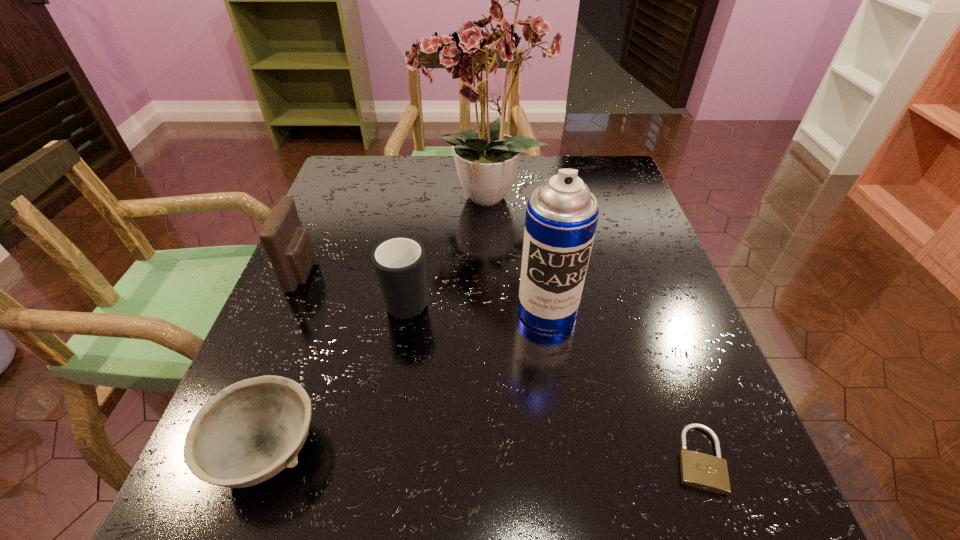
Choose which object is the nearest neighbor to the tallest object. Please provide its 2D coordinates. Your answer should be formatted as a tuple, i.e. [(x, y)], where the tuple contains the x and y coordinates of a point satisfying the conditions above.

[(399, 262)]

The width and height of the screenshot is (960, 540). What are the coordinates of `free region that satisfies the following two spatial constraints: 1. on the label side of the second tallest object; 2. on the right side of the padlock` in the screenshot? It's located at (568, 458).

Locate an element on the screen. This screenshot has width=960, height=540. free space that satisfies the following two spatial constraints: 1. with an open flap on the pouch; 2. on the left side of the bowl is located at coordinates (229, 451).

Identify the location of free location that satisfies the following two spatial constraints: 1. on the side of the mug with the handle; 2. with an open flap on the pouch. (412, 273).

Identify the location of free location that satisfies the following two spatial constraints: 1. on the label side of the aerosol can; 2. on the left side of the rightmost object. (568, 458).

The width and height of the screenshot is (960, 540). I want to click on free location that satisfies the following two spatial constraints: 1. on the front-facing side of the flower arrangement; 2. on the front side of the bowl, so click(x=482, y=451).